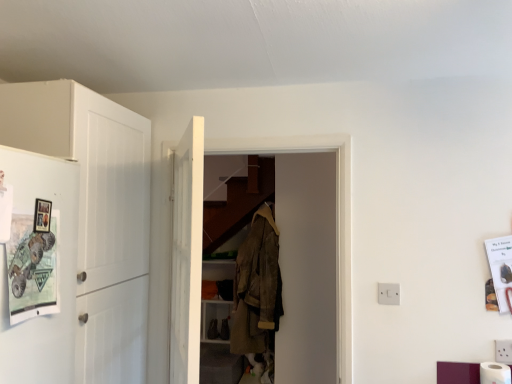
Find the location of a particular element. white matte toilet paper at lower right is located at coordinates (494, 373).

Describe the element at coordinates (389, 293) in the screenshot. I see `white plastic electric outlet at center right` at that location.

The height and width of the screenshot is (384, 512). What do you see at coordinates (257, 286) in the screenshot?
I see `camouflage fabric jacket at center` at bounding box center [257, 286].

Where is `white matte cabinet at left`? The height and width of the screenshot is (384, 512). white matte cabinet at left is located at coordinates (97, 214).

Who is smaller, white matte cabinet at left or white matte toilet paper at lower right?

white matte toilet paper at lower right is smaller.

From a real-world perspective, is white matte cabinet at left over white matte toilet paper at lower right?

Yes, from a real-world perspective, white matte cabinet at left is above white matte toilet paper at lower right.

Which point is more forward, (26,114) or (497,371)?

Point (26,114)

How many degrees apart are the facing directions of white matte cabinet at left and white matte toilet paper at lower right?

There is a 90.6-degree angle between the facing directions of white matte cabinet at left and white matte toilet paper at lower right.

Considering the positions of point (247, 298) and point (33, 364), is point (247, 298) closer or farther from the camera than point (33, 364)?

Point (247, 298) appears to be farther away from the viewer than point (33, 364).

Which object is thinner, camouflage fabric jacket at center or matte white fridge at left?

Thinner between the two is matte white fridge at left.

You are a GUI agent. You are given a task and a screenshot of the screen. Output one action in this format:
    pyautogui.click(x=<x>, y=<y>)
    Task: Click on the clothing that appears below the matte white fridge at left (from a real-world perspective)
    
    Given the screenshot: What is the action you would take?
    pyautogui.click(x=257, y=286)

Considering the positions of objects white wooden door at center and camouflage fabric jacket at center in the image provided, who is more to the right, white wooden door at center or camouflage fabric jacket at center?

camouflage fabric jacket at center is more to the right.

Between white wooden door at center and camouflage fabric jacket at center, which one has more height?

With more height is white wooden door at center.

Can you confirm if white wooden door at center is wider than camouflage fabric jacket at center?

In fact, white wooden door at center might be narrower than camouflage fabric jacket at center.

From the image's perspective, is white wooden door at center on top of camouflage fabric jacket at center?

Yes, from the image's perspective, white wooden door at center is above camouflage fabric jacket at center.

Which object is thinner, white matte cabinet at left or white plastic electric outlet at center right?

Thinner between the two is white plastic electric outlet at center right.

Image resolution: width=512 pixels, height=384 pixels. Find the location of `electric outlet lying below the white matte cabinet at left (from the image's perspective)`. electric outlet lying below the white matte cabinet at left (from the image's perspective) is located at coordinates (389, 293).

In the scene shown: Choose the correct answer: Is white matte cabinet at left inside white plastic electric outlet at center right or outside it?

white matte cabinet at left is outside white plastic electric outlet at center right.

How different are the orientations of white matte cabinet at left and white plastic electric outlet at center right in degrees?

They differ by 90.6 degrees in their facing directions.

From the image's perspective, which one is positioned higher, camouflage fabric jacket at center or white plastic electric outlet at center right?

From the image's view, white plastic electric outlet at center right is above.

Consider the image. In the image, is camouflage fabric jacket at center on the left side or the right side of white plastic electric outlet at center right?

camouflage fabric jacket at center is to the left of white plastic electric outlet at center right.

From a real-world perspective, is camouflage fabric jacket at center positioned above or below white plastic electric outlet at center right?

In terms of real-world spatial position, camouflage fabric jacket at center is below white plastic electric outlet at center right.

This screenshot has height=384, width=512. Identify the location of toilet paper located below the matte white fridge at left (from the image's perspective). (494, 373).

From a real-world perspective, is matte white fridge at left positioned above or below white matte toilet paper at lower right?

In terms of real-world spatial position, matte white fridge at left is above white matte toilet paper at lower right.

Considering the sizes of matte white fridge at left and white matte toilet paper at lower right in the image, is matte white fridge at left bigger or smaller than white matte toilet paper at lower right?

Clearly, matte white fridge at left is larger in size than white matte toilet paper at lower right.

How far apart are matte white fridge at left and white matte toilet paper at lower right?

A distance of 1.65 meters exists between matte white fridge at left and white matte toilet paper at lower right.

Can you confirm if white matte toilet paper at lower right is shorter than camouflage fabric jacket at center?

Indeed, white matte toilet paper at lower right has a lesser height compared to camouflage fabric jacket at center.

Can you confirm if white matte toilet paper at lower right is thinner than camouflage fabric jacket at center?

Correct, the width of white matte toilet paper at lower right is less than that of camouflage fabric jacket at center.

From a real-world perspective, is white matte toilet paper at lower right physically located above or below camouflage fabric jacket at center?

In terms of real-world spatial position, white matte toilet paper at lower right is below camouflage fabric jacket at center.

Can you confirm if white matte toilet paper at lower right is positioned to the left of camouflage fabric jacket at center?

Incorrect, white matte toilet paper at lower right is not on the left side of camouflage fabric jacket at center.

Identify the location of cabinetry above the white matte toilet paper at lower right (from the image's perspective). The image size is (512, 384). (97, 214).

Where is `fridge on the left of camouflage fabric jacket at center`? fridge on the left of camouflage fabric jacket at center is located at coordinates (38, 270).

Considering their positions, is matte white fridge at left positioned closer to white matte toilet paper at lower right than camouflage fabric jacket at center?

Based on the image, camouflage fabric jacket at center appears to be nearer to white matte toilet paper at lower right.

In the scene shown: Looking at the image, which one is located further to camouflage fabric jacket at center, matte white fridge at left or white plastic electric outlet at center right?

Based on the image, matte white fridge at left appears to be further to camouflage fabric jacket at center.

From the image, which object appears to be nearer to white matte toilet paper at lower right, white matte cabinet at left or matte white fridge at left?

Based on the image, white matte cabinet at left appears to be nearer to white matte toilet paper at lower right.

Looking at the image, which one is located closer to white matte toilet paper at lower right, white matte cabinet at left or camouflage fabric jacket at center?

camouflage fabric jacket at center is closer to white matte toilet paper at lower right.

Based on their spatial positions, is white matte toilet paper at lower right or white wooden door at center further from white matte cabinet at left?

white matte toilet paper at lower right is positioned further to the anchor white matte cabinet at left.

Estimate the real-world distances between objects in this image. Which object is further from white wooden door at center, matte white fridge at left or white plastic electric outlet at center right?

white plastic electric outlet at center right.

From the image, which object appears to be farther from camouflage fabric jacket at center, white plastic electric outlet at center right or white matte cabinet at left?

white matte cabinet at left.

When comparing their distances from camouflage fabric jacket at center, does white wooden door at center or white matte toilet paper at lower right seem closer?

white wooden door at center lies closer to camouflage fabric jacket at center than the other object.

At what (x,y) coordinates should I click in order to perform the action: click on clothing located between white matte cabinet at left and white matte toilet paper at lower right in the left-right direction. Please return your answer as a coordinate pair (x, y). Image resolution: width=512 pixels, height=384 pixels. Looking at the image, I should click on (257, 286).

Where is `fridge situated between white matte cabinet at left and white plastic electric outlet at center right from left to right`? fridge situated between white matte cabinet at left and white plastic electric outlet at center right from left to right is located at coordinates (38, 270).

Where is `electric outlet situated between white wooden door at center and white matte toilet paper at lower right from left to right`? electric outlet situated between white wooden door at center and white matte toilet paper at lower right from left to right is located at coordinates (389, 293).

What are the coordinates of `electric outlet between matte white fridge at left and white matte toilet paper at lower right in the horizontal direction` in the screenshot? It's located at (389, 293).